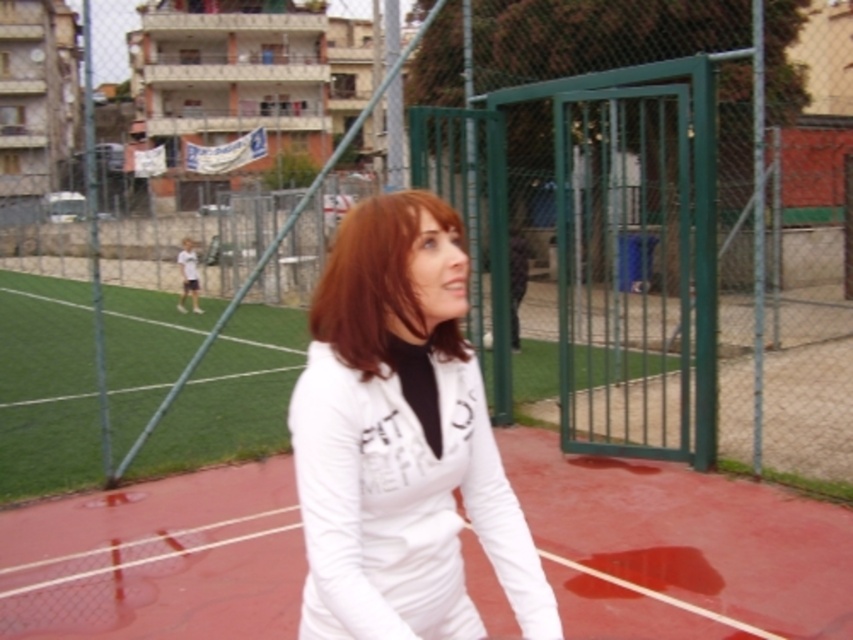
Can you confirm if white matte jacket at center is positioned above shiny brown hair at center?

No, white matte jacket at center is not above shiny brown hair at center.

Does white matte jacket at center appear under shiny brown hair at center?

Indeed, white matte jacket at center is positioned under shiny brown hair at center.

Find the location of `white matte jacket at center`. white matte jacket at center is located at coordinates (399, 444).

At what (x,y) coordinates should I click in order to perform the action: click on white matte jacket at center. Please return your answer as a coordinate pair (x, y). Image resolution: width=853 pixels, height=640 pixels. Looking at the image, I should click on (399, 444).

Is white fabric tennis court at center further to camera compared to shiny brown hair at center?

Yes, it is.

Based on the photo, does white fabric tennis court at center appear on the left side of shiny brown hair at center?

Yes, white fabric tennis court at center is to the left of shiny brown hair at center.

The width and height of the screenshot is (853, 640). Describe the element at coordinates (158, 557) in the screenshot. I see `white fabric tennis court at center` at that location.

The height and width of the screenshot is (640, 853). I want to click on white fabric tennis court at center, so click(x=158, y=557).

Which is in front, point (50, 589) or point (312, 321)?

Point (312, 321)

Between white fabric tennis court at center and white matte jacket at center, which one appears on the left side from the viewer's perspective?

Positioned to the left is white fabric tennis court at center.

The height and width of the screenshot is (640, 853). In order to click on white fabric tennis court at center in this screenshot , I will do `click(158, 557)`.

At what (x,y) coordinates should I click in order to perform the action: click on white fabric tennis court at center. Please return your answer as a coordinate pair (x, y). This screenshot has width=853, height=640. Looking at the image, I should click on (158, 557).